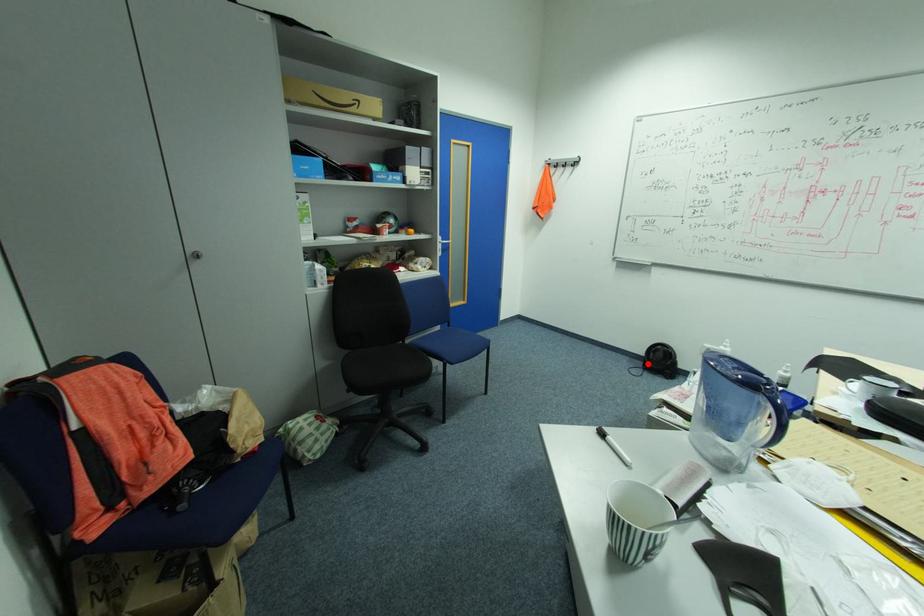
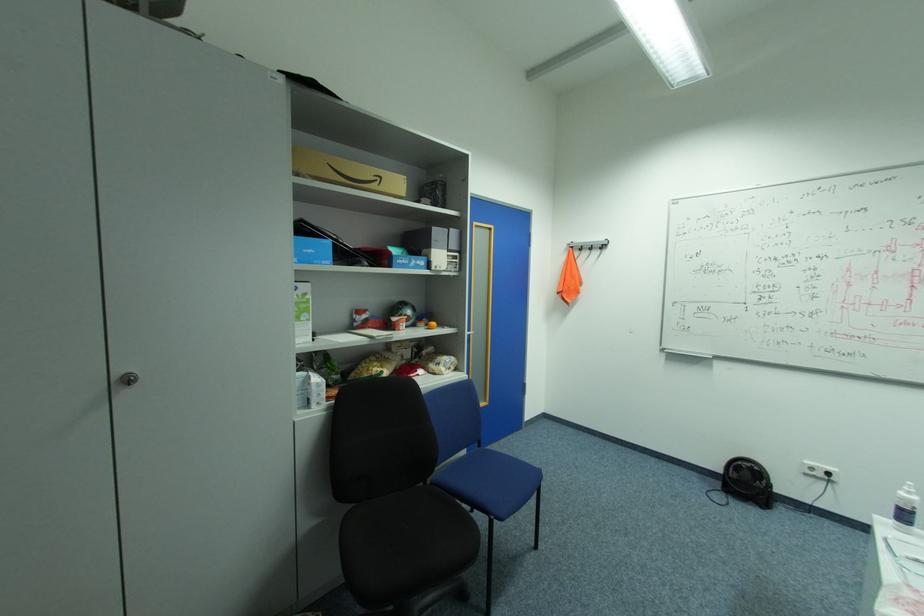
In the second image, find the point that corresponds to the highlighted location in the first image.

(724, 484)